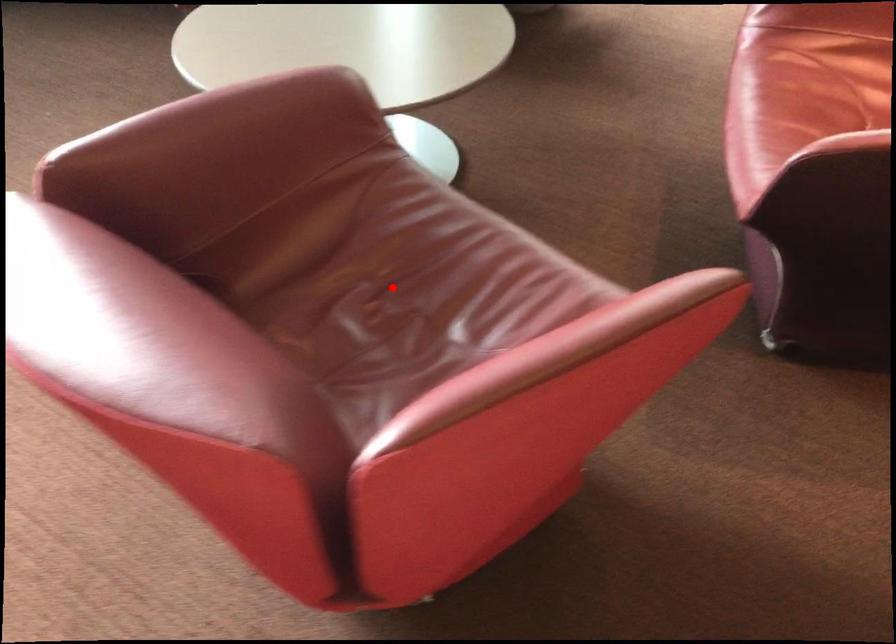
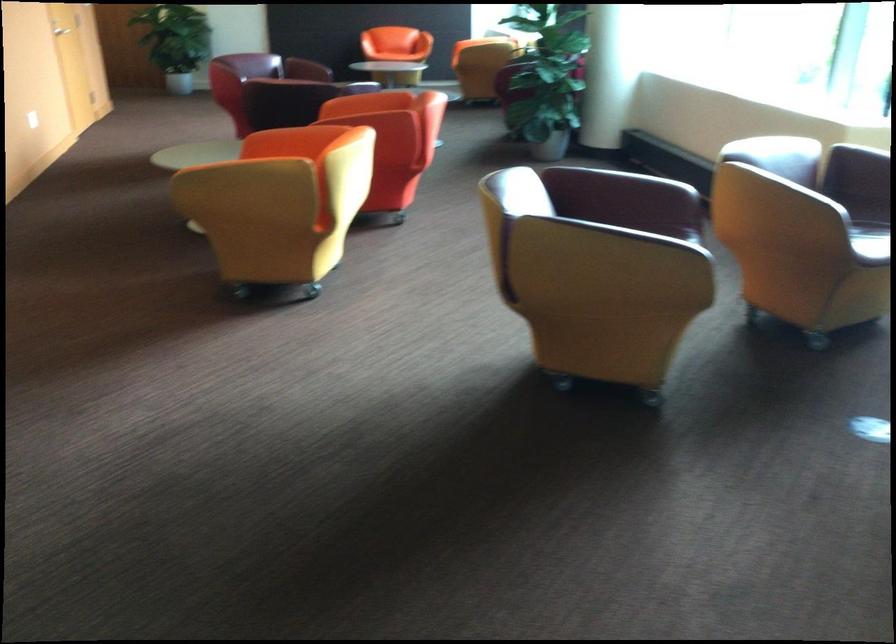
Question: I am providing you with two images of the same scene from different viewpoints. A red point is marked on the first image. At the location where the point appears in image 1, is it still visible in image 2?

Choices:
 (A) Yes
 (B) No

Answer: (B)